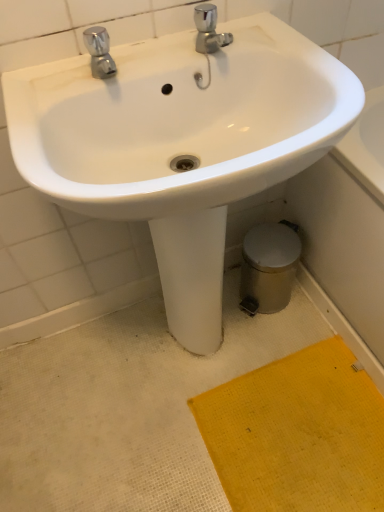
Where is `vacant space underneath white glossy sink at center (from a real-world perspective)`? The height and width of the screenshot is (512, 384). vacant space underneath white glossy sink at center (from a real-world perspective) is located at coordinates (201, 358).